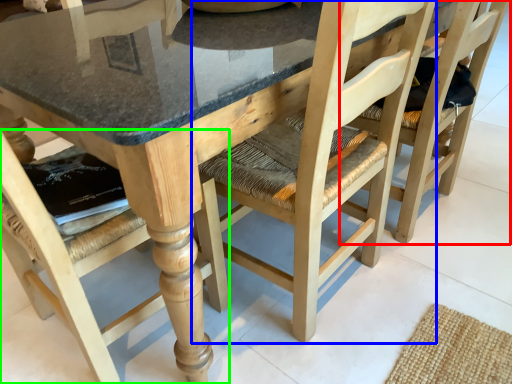
Question: Which is farther away from chair (highlighted by a red box)? chair (highlighted by a blue box) or chair (highlighted by a green box)?

Choices:
 (A) chair
 (B) chair

Answer: (B)